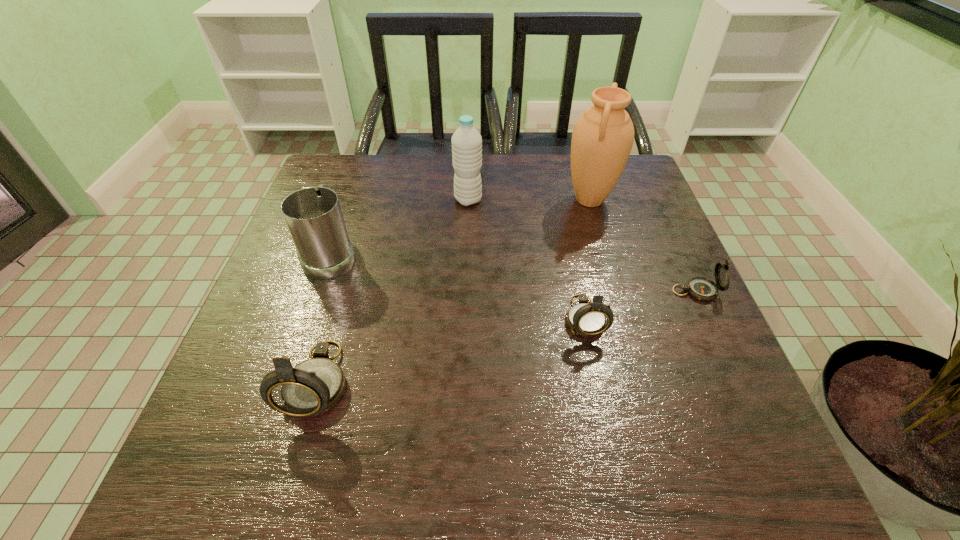
Where is `blank area located 0.080m on the side of the mug with the handle`? blank area located 0.080m on the side of the mug with the handle is located at coordinates coord(347,210).

I want to click on free space located on the side of the mug with the handle, so click(356, 182).

Locate an element on the screen. vacant region located on the side of the mug with the handle is located at coordinates (351, 197).

Image resolution: width=960 pixels, height=540 pixels. Identify the location of free location located 0.160m on the front of the urn. (608, 261).

Where is `free spot located 0.240m on the front of the second tallest object`? free spot located 0.240m on the front of the second tallest object is located at coordinates (466, 273).

You are a GUI agent. You are given a task and a screenshot of the screen. Output one action in this format:
    pyautogui.click(x=<x>, y=<y>)
    Task: Click on the urn that is at the far edge
    The image size is (960, 540).
    Given the screenshot: What is the action you would take?
    pyautogui.click(x=602, y=139)

The image size is (960, 540). What are the coordinates of `water bottle present at the far edge` in the screenshot? It's located at (466, 141).

At what (x,y) coordinates should I click in order to perform the action: click on object that is positioned at the near edge. Please return your answer as a coordinate pair (x, y). Looking at the image, I should click on (314, 386).

The image size is (960, 540). Identify the location of compass located in the left edge section of the desktop. (314, 386).

Where is `mug at the left edge`? Image resolution: width=960 pixels, height=540 pixels. mug at the left edge is located at coordinates (313, 215).